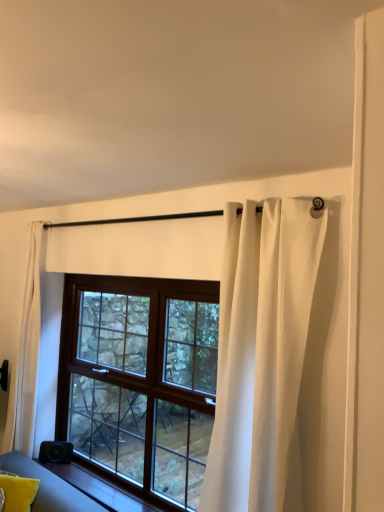
Question: Is brown wooden window at center bigger than white sheer curtain at left, which is the 1th curtain from back to front?

Choices:
 (A) yes
 (B) no

Answer: (B)

Question: From a real-world perspective, is brown wooden window at center below white sheer curtain at left, positioned as the 2th curtain in front-to-back order?

Choices:
 (A) no
 (B) yes

Answer: (B)

Question: From the image's perspective, does brown wooden window at center appear higher than white sheer curtain at left, positioned as the 2th curtain in front-to-back order?

Choices:
 (A) no
 (B) yes

Answer: (A)

Question: Could you tell me if brown wooden window at center is turned towards white sheer curtain at left, which is the 1th curtain from back to front?

Choices:
 (A) yes
 (B) no

Answer: (B)

Question: From the image's perspective, is brown wooden window at center beneath white sheer curtain at left, which is the 1th curtain from back to front?

Choices:
 (A) no
 (B) yes

Answer: (B)

Question: Considering the positions of white sheer curtain at upper center, placed as the 2th curtain when sorted from left to right, and yellow fabric pillow at lower left in the image, is white sheer curtain at upper center, placed as the 2th curtain when sorted from left to right, taller or shorter than yellow fabric pillow at lower left?

Choices:
 (A) short
 (B) tall

Answer: (B)

Question: From a real-world perspective, is white sheer curtain at upper center, which is counted as the 2th curtain, starting from the back, positioned above or below yellow fabric pillow at lower left?

Choices:
 (A) below
 (B) above

Answer: (B)

Question: From the image's perspective, is white sheer curtain at upper center, placed as the 2th curtain when sorted from left to right, above or below yellow fabric pillow at lower left?

Choices:
 (A) below
 (B) above

Answer: (B)

Question: Is white sheer curtain at upper center, which is counted as the 2th curtain, starting from the back, in front of or behind yellow fabric pillow at lower left in the image?

Choices:
 (A) front
 (B) behind

Answer: (A)

Question: Considering their positions, is white sheer curtain at left, which is the 1th curtain from back to front, located in front of or behind white sheer curtain at upper center, the 1th curtain positioned from the front?

Choices:
 (A) behind
 (B) front

Answer: (A)

Question: Is white sheer curtain at left, positioned as the 2th curtain in front-to-back order, wider or thinner than white sheer curtain at upper center, placed as the 1th curtain when sorted from right to left?

Choices:
 (A) thin
 (B) wide

Answer: (B)

Question: From a real-world perspective, is white sheer curtain at left, placed as the 1th curtain when sorted from left to right, positioned above or below white sheer curtain at upper center, which is counted as the 2th curtain, starting from the back?

Choices:
 (A) above
 (B) below

Answer: (B)

Question: From the image's perspective, is white sheer curtain at left, the second curtain viewed from the right, positioned above or below white sheer curtain at upper center, placed as the 1th curtain when sorted from right to left?

Choices:
 (A) above
 (B) below

Answer: (B)

Question: Looking at the image, does white sheer curtain at upper center, placed as the 2th curtain when sorted from left to right, seem bigger or smaller compared to white sheer curtain at left, positioned as the 2th curtain in front-to-back order?

Choices:
 (A) big
 (B) small

Answer: (B)

Question: Looking at their shapes, would you say white sheer curtain at upper center, the 1th curtain positioned from the front, is wider or thinner than white sheer curtain at left, the second curtain viewed from the right?

Choices:
 (A) thin
 (B) wide

Answer: (A)